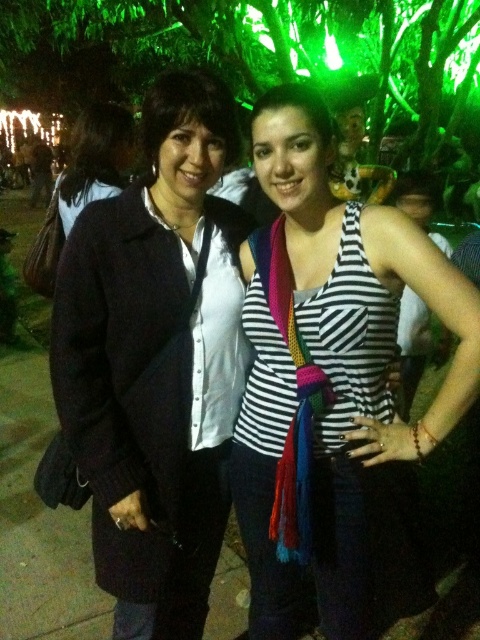
Question: Which of the following is the farthest from the observer?

Choices:
 (A) striped fabric tank top at center
 (B) dark blue sweater at left
 (C) matte black sweater at left

Answer: (B)

Question: Which of the following is the farthest from the observer?

Choices:
 (A) striped fabric tank top at center
 (B) dark blue sweater at left
 (C) matte black sweater at left

Answer: (B)

Question: Is striped fabric tank top at center thinner than dark blue sweater at left?

Choices:
 (A) no
 (B) yes

Answer: (A)

Question: Is matte black sweater at left above dark blue sweater at left?

Choices:
 (A) yes
 (B) no

Answer: (B)

Question: Does striped fabric tank top at center have a larger size compared to matte black sweater at left?

Choices:
 (A) yes
 (B) no

Answer: (A)

Question: Which object appears closest to the camera in this image?

Choices:
 (A) dark blue sweater at left
 (B) striped fabric tank top at center

Answer: (B)